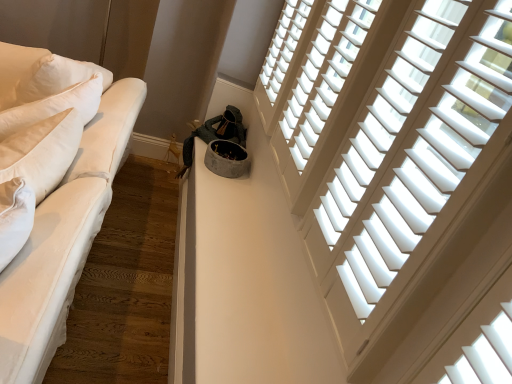
What do you see at coordinates (405, 167) in the screenshot? I see `white wood blinds at upper right, marked as the first window in a front-to-back arrangement` at bounding box center [405, 167].

This screenshot has height=384, width=512. Describe the element at coordinates (284, 46) in the screenshot. I see `white wood blinds at upper right, the third window in the front-to-back sequence` at that location.

The image size is (512, 384). I want to click on white cotton studio couch at left, so click(x=62, y=226).

Is white wood blinds at upper right, marked as the first window in a front-to-back arrangement, facing towards white wood blinds at upper right, the third window in the front-to-back sequence?

No, white wood blinds at upper right, marked as the first window in a front-to-back arrangement, is not facing towards white wood blinds at upper right, the third window in the front-to-back sequence.

Can you tell me how much white wood blinds at upper right, arranged as the third window when viewed from the back, and white wood blinds at upper right, positioned as the first window in back-to-front order, differ in facing direction?

There is a 0.00399-degree angle between the facing directions of white wood blinds at upper right, arranged as the third window when viewed from the back, and white wood blinds at upper right, positioned as the first window in back-to-front order.

Is white wood blinds at upper right, arranged as the third window when viewed from the back, wider or thinner than white wood blinds at upper right, the third window in the front-to-back sequence?

Considering their sizes, white wood blinds at upper right, arranged as the third window when viewed from the back, looks broader than white wood blinds at upper right, the third window in the front-to-back sequence.

Looking at this image, which is further, (412, 220) or (298, 43)?

The point (298, 43) is behind.

Between point (16, 271) and point (485, 29), which one is positioned in front?

The point (485, 29) is closer.

Is white cotton studio couch at left turned away from white wood blinds at upper right, arranged as the third window when viewed from the back?

No, white cotton studio couch at left's orientation is not away from white wood blinds at upper right, arranged as the third window when viewed from the back.

In the scene shown: Which is more to the right, white cotton studio couch at left or white wood blinds at upper right, arranged as the third window when viewed from the back?

From the viewer's perspective, white wood blinds at upper right, arranged as the third window when viewed from the back, appears more on the right side.

From a real-world perspective, between white cotton studio couch at left and white wood blinds at upper right, arranged as the third window when viewed from the back, who is vertically lower?

white cotton studio couch at left, from a real-world perspective.

Is white wood blinds at upper right, placed as the second window when sorted from front to back, at the back of white wood blinds at upper right, arranged as the third window when viewed from the back?

No, white wood blinds at upper right, arranged as the third window when viewed from the back, is not facing away from white wood blinds at upper right, placed as the second window when sorted from front to back.

Considering the relative sizes of white wood blinds at upper right, arranged as the third window when viewed from the back, and white wood blinds at upper right, placed as the second window when sorted from front to back, in the image provided, is white wood blinds at upper right, arranged as the third window when viewed from the back, thinner than white wood blinds at upper right, placed as the second window when sorted from front to back,?

Incorrect, the width of white wood blinds at upper right, arranged as the third window when viewed from the back, is not less than that of white wood blinds at upper right, placed as the second window when sorted from front to back.

Considering the positions of objects white wood blinds at upper right, arranged as the third window when viewed from the back, and white wood blinds at upper right, the 2th window in the back-to-front sequence, in the image provided, who is in front, white wood blinds at upper right, arranged as the third window when viewed from the back, or white wood blinds at upper right, the 2th window in the back-to-front sequence,?

Positioned in front is white wood blinds at upper right, arranged as the third window when viewed from the back.

Is white wood blinds at upper right, placed as the second window when sorted from front to back, spatially inside white cotton studio couch at left, or outside of it?

white wood blinds at upper right, placed as the second window when sorted from front to back, is spatially situated outside white cotton studio couch at left.

Is white wood blinds at upper right, the 2th window in the back-to-front sequence, bigger or smaller than white cotton studio couch at left?

Considering their sizes, white wood blinds at upper right, the 2th window in the back-to-front sequence, takes up less space than white cotton studio couch at left.

Can you tell me how much white wood blinds at upper right, the 2th window in the back-to-front sequence, and white cotton studio couch at left differ in facing direction?

The angle between the facing direction of white wood blinds at upper right, the 2th window in the back-to-front sequence, and the facing direction of white cotton studio couch at left is 0.846 degrees.

Does point (371, 0) come behind point (109, 191)?

No, it is not.

Which of these two, white cotton studio couch at left or white wood blinds at upper right, the third window in the front-to-back sequence, is thinner?

With smaller width is white wood blinds at upper right, the third window in the front-to-back sequence.

Based on the photo, considering the relative sizes of white cotton studio couch at left and white wood blinds at upper right, positioned as the first window in back-to-front order, in the image provided, is white cotton studio couch at left bigger than white wood blinds at upper right, positioned as the first window in back-to-front order,?

Yes.

Choose the correct answer: Is white cotton studio couch at left inside white wood blinds at upper right, the third window in the front-to-back sequence, or outside it?

The correct answer is: outside.

Which object is positioned more to the left, white cotton studio couch at left or white wood blinds at upper right, positioned as the first window in back-to-front order?

From the viewer's perspective, white cotton studio couch at left appears more on the left side.

From a real-world perspective, is white wood blinds at upper right, placed as the second window when sorted from front to back, positioned above or below white wood blinds at upper right, marked as the first window in a front-to-back arrangement?

white wood blinds at upper right, placed as the second window when sorted from front to back, is below white wood blinds at upper right, marked as the first window in a front-to-back arrangement.

From the image's perspective, is white wood blinds at upper right, placed as the second window when sorted from front to back, below white wood blinds at upper right, marked as the first window in a front-to-back arrangement?

No.

Consider the image. Is white wood blinds at upper right, placed as the second window when sorted from front to back, wider than white wood blinds at upper right, marked as the first window in a front-to-back arrangement?

Incorrect, the width of white wood blinds at upper right, placed as the second window when sorted from front to back, does not surpass that of white wood blinds at upper right, marked as the first window in a front-to-back arrangement.

Is white wood blinds at upper right, positioned as the first window in back-to-front order, shorter than white cotton studio couch at left?

Indeed, white wood blinds at upper right, positioned as the first window in back-to-front order, has a lesser height compared to white cotton studio couch at left.

What are the coordinates of `the 1st window to the right of the white cotton studio couch at left, starting your count from the anchor` in the screenshot? It's located at (284, 46).

Is white wood blinds at upper right, positioned as the first window in back-to-front order, to the left of white cotton studio couch at left from the viewer's perspective?

Incorrect, white wood blinds at upper right, positioned as the first window in back-to-front order, is not on the left side of white cotton studio couch at left.

Which point is more forward, (290, 48) or (28, 135)?

The point (28, 135) is closer.

Find the location of a particular element. the 2nd window to the right of the white wood blinds at upper right, positioned as the first window in back-to-front order, starting your count from the anchor is located at coordinates (405, 167).

You are a GUI agent. You are given a task and a screenshot of the screen. Output one action in this format:
    pyautogui.click(x=<x>, y=<y>)
    Task: Click on the studio couch located underneath the white wood blinds at upper right, marked as the first window in a front-to-back arrangement (from a real-world perspective)
    The width and height of the screenshot is (512, 384).
    Given the screenshot: What is the action you would take?
    pyautogui.click(x=62, y=226)

Based on their spatial positions, is white wood blinds at upper right, arranged as the third window when viewed from the back, or white wood blinds at upper right, positioned as the first window in back-to-front order, further from white wood blinds at upper right, the 2th window in the back-to-front sequence?

The object further to white wood blinds at upper right, the 2th window in the back-to-front sequence, is white wood blinds at upper right, positioned as the first window in back-to-front order.

Based on their spatial positions, is white wood blinds at upper right, marked as the first window in a front-to-back arrangement, or white wood blinds at upper right, the third window in the front-to-back sequence, closer to white cotton studio couch at left?

white wood blinds at upper right, marked as the first window in a front-to-back arrangement, is closer to white cotton studio couch at left.

From the image, which object appears to be nearer to white wood blinds at upper right, placed as the second window when sorted from front to back, white cotton studio couch at left or white wood blinds at upper right, positioned as the first window in back-to-front order?

Among the two, white wood blinds at upper right, positioned as the first window in back-to-front order, is located nearer to white wood blinds at upper right, placed as the second window when sorted from front to back.

From the image, which object appears to be farther from white cotton studio couch at left, white wood blinds at upper right, marked as the first window in a front-to-back arrangement, or white wood blinds at upper right, the 2th window in the back-to-front sequence?

Based on the image, white wood blinds at upper right, marked as the first window in a front-to-back arrangement, appears to be further to white cotton studio couch at left.

Which object lies nearer to the anchor point white cotton studio couch at left, white wood blinds at upper right, the third window in the front-to-back sequence, or white wood blinds at upper right, marked as the first window in a front-to-back arrangement?

Based on the image, white wood blinds at upper right, marked as the first window in a front-to-back arrangement, appears to be nearer to white cotton studio couch at left.

Considering their positions, is white cotton studio couch at left positioned closer to white wood blinds at upper right, positioned as the first window in back-to-front order, than white wood blinds at upper right, placed as the second window when sorted from front to back?

The object closer to white wood blinds at upper right, positioned as the first window in back-to-front order, is white wood blinds at upper right, placed as the second window when sorted from front to back.

Looking at the image, which one is located further to white wood blinds at upper right, positioned as the first window in back-to-front order, white cotton studio couch at left or white wood blinds at upper right, marked as the first window in a front-to-back arrangement?

white cotton studio couch at left lies further to white wood blinds at upper right, positioned as the first window in back-to-front order, than the other object.

Looking at the image, which one is located closer to white cotton studio couch at left, white wood blinds at upper right, placed as the second window when sorted from front to back, or white wood blinds at upper right, the third window in the front-to-back sequence?

white wood blinds at upper right, placed as the second window when sorted from front to back, is positioned closer to the anchor white cotton studio couch at left.

This screenshot has height=384, width=512. What are the coordinates of `window between white wood blinds at upper right, marked as the first window in a front-to-back arrangement, and white wood blinds at upper right, the third window in the front-to-back sequence, along the z-axis` in the screenshot? It's located at (322, 83).

Find the location of a particular element. This screenshot has width=512, height=384. window between white cotton studio couch at left and white wood blinds at upper right, placed as the second window when sorted from front to back is located at coordinates (284, 46).